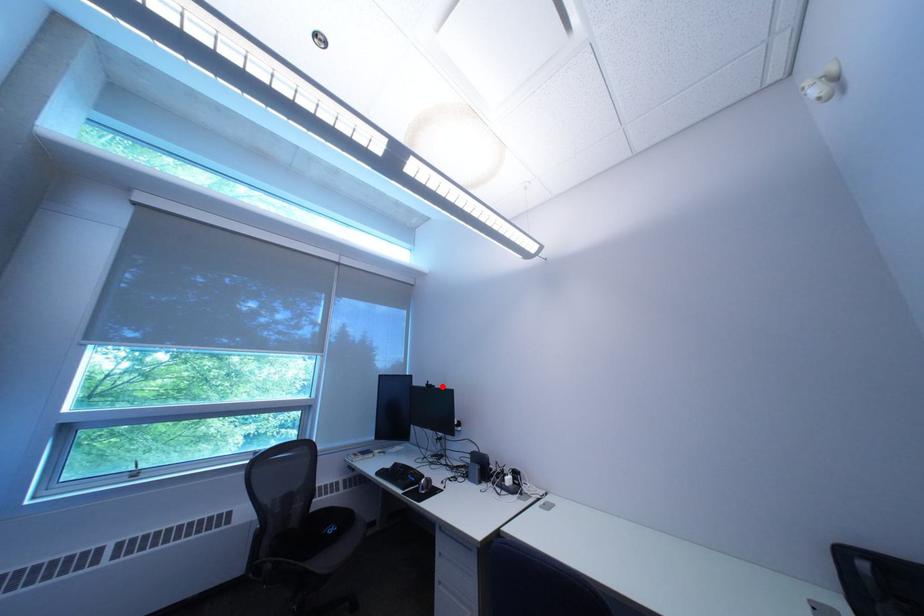
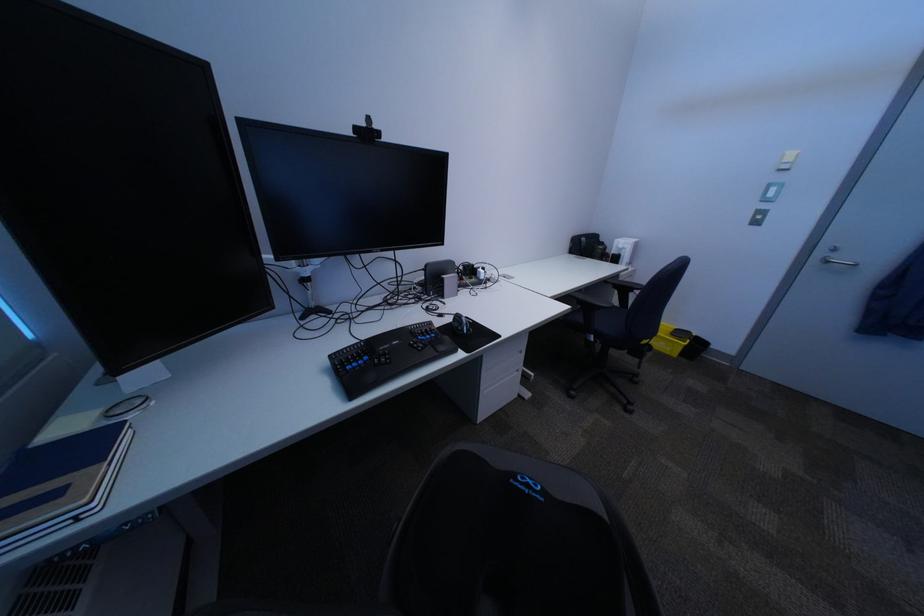
In the second image, find the point that corresponds to the highlighted location in the first image.

(371, 131)